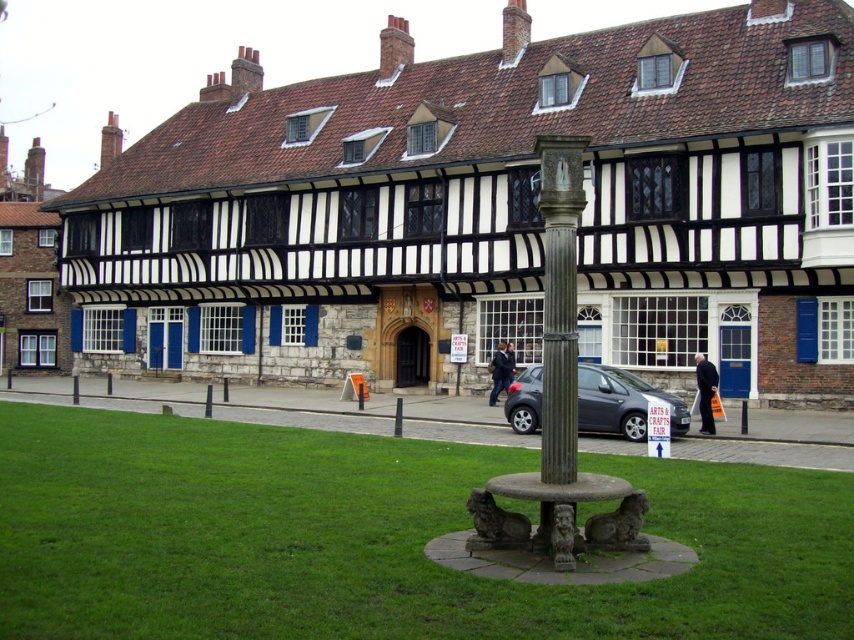
Is green grass at center to the right of matte gray car at center from the viewer's perspective?

In fact, green grass at center is to the left of matte gray car at center.

Between point (244, 547) and point (680, 416), which one is positioned behind?

Positioned behind is point (680, 416).

At what (x,y) coordinates should I click in order to perform the action: click on green grass at center. Please return your answer as a coordinate pair (x, y). This screenshot has height=640, width=854. Looking at the image, I should click on click(x=373, y=538).